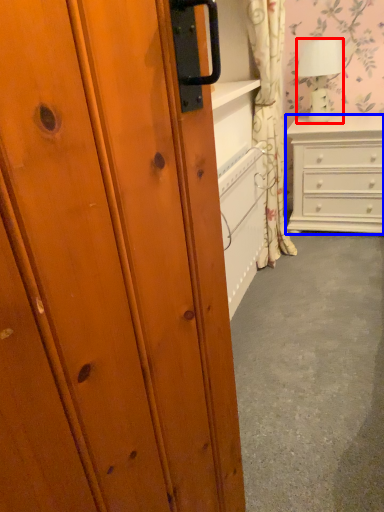
Question: Which point is further to the camera, lamp (highlighted by a red box) or chest of drawers (highlighted by a blue box)?

Choices:
 (A) lamp
 (B) chest of drawers

Answer: (A)